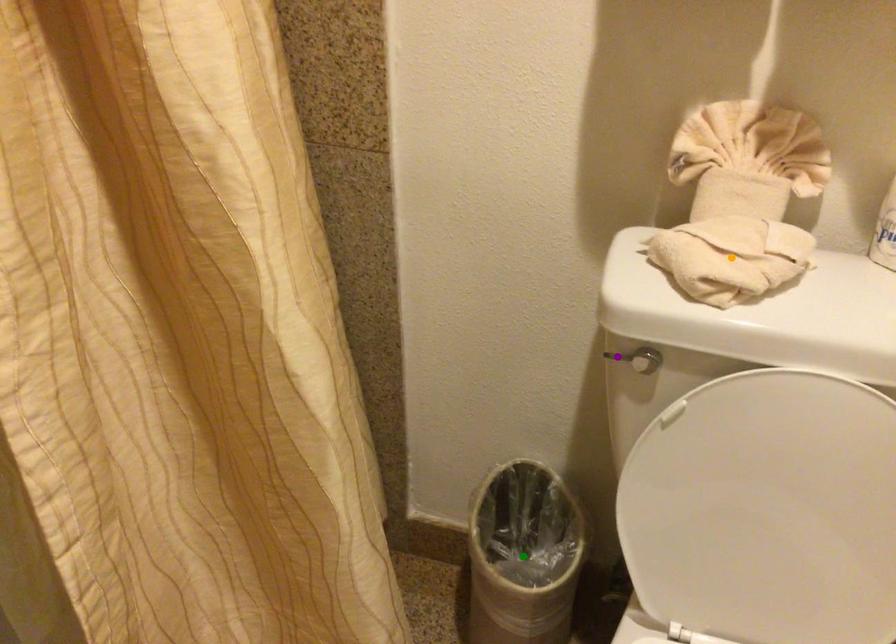
Based on the photo, order these from nearest to farthest:
1. green point
2. purple point
3. orange point

orange point < purple point < green point